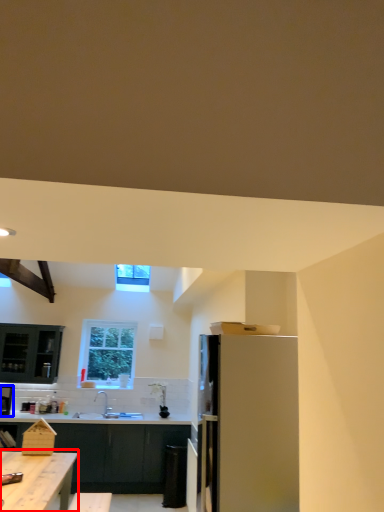
Question: Which point is closer to the camera, table (highlighted by a red box) or kitchen appliance (highlighted by a blue box)?

Choices:
 (A) table
 (B) kitchen appliance

Answer: (A)